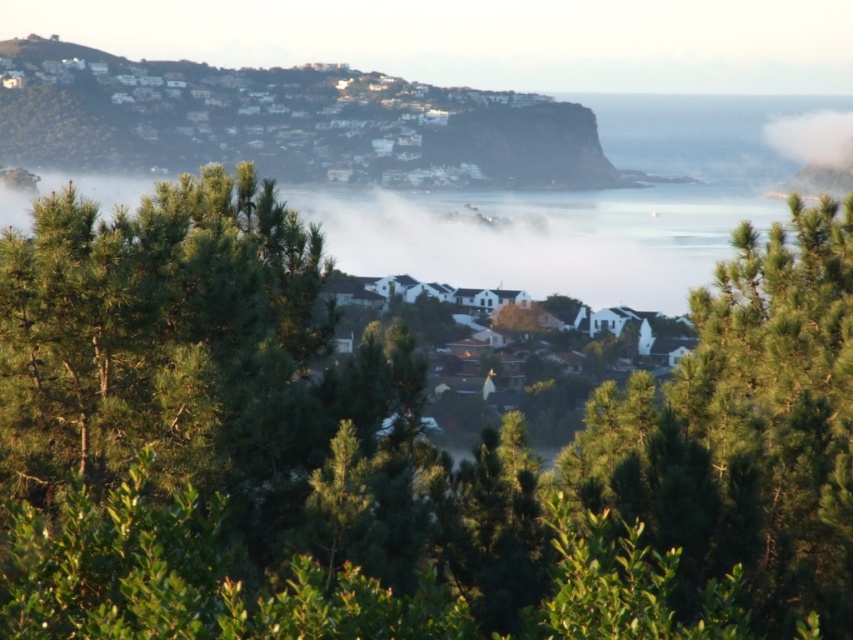
Question: Considering the real-world distances, which object is farthest from the green leafy tree at center?

Choices:
 (A) white matte houses at upper left
 (B) white fluffy cloud at upper right
 (C) white matte houses at center

Answer: (B)

Question: Does green leafy tree at center appear on the left side of white matte houses at upper left?

Choices:
 (A) yes
 (B) no

Answer: (B)

Question: Does green leafy tree at center have a greater width compared to white matte houses at upper left?

Choices:
 (A) no
 (B) yes

Answer: (A)

Question: Which point is farther to the camera?

Choices:
 (A) white matte houses at center
 (B) green leafy tree at center
 (C) white matte houses at upper left
 (D) white fluffy cloud at upper right

Answer: (D)

Question: Can you confirm if green leafy tree at center is thinner than white matte houses at upper left?

Choices:
 (A) no
 (B) yes

Answer: (B)

Question: Which point is closer to the camera taking this photo?

Choices:
 (A) (780, 152)
 (B) (567, 608)
 (C) (431, 129)
 (D) (514, 381)

Answer: (B)